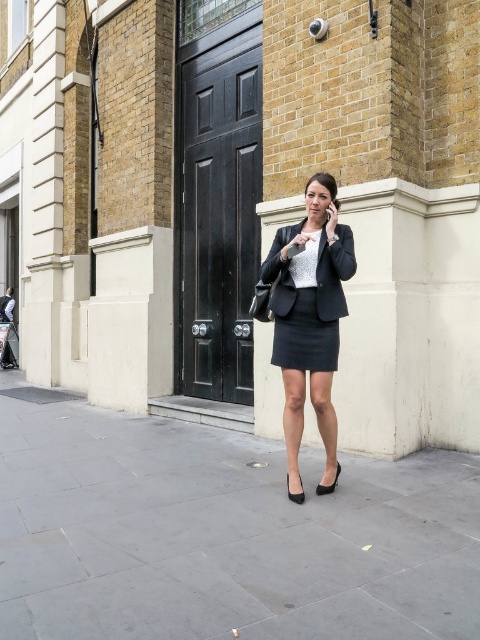
Question: Is gray concrete pavement at center above matte black blazer at center?

Choices:
 (A) no
 (B) yes

Answer: (A)

Question: Is matte black blazer at center smaller than matte black skirt at center?

Choices:
 (A) no
 (B) yes

Answer: (A)

Question: Is gray concrete pavement at center thinner than matte black blazer at center?

Choices:
 (A) yes
 (B) no

Answer: (B)

Question: Which of the following is the closest to the observer?

Choices:
 (A) (311, 214)
 (B) (108, 417)
 (C) (312, 326)

Answer: (C)

Question: Which of these objects is positioned farthest from the gray concrete pavement at center?

Choices:
 (A) matte black skirt at center
 (B) matte black blazer at center

Answer: (A)

Question: Among these points, which one is farthest from the camera?

Choices:
 (A) (282, 598)
 (B) (309, 364)
 (C) (325, 305)

Answer: (B)